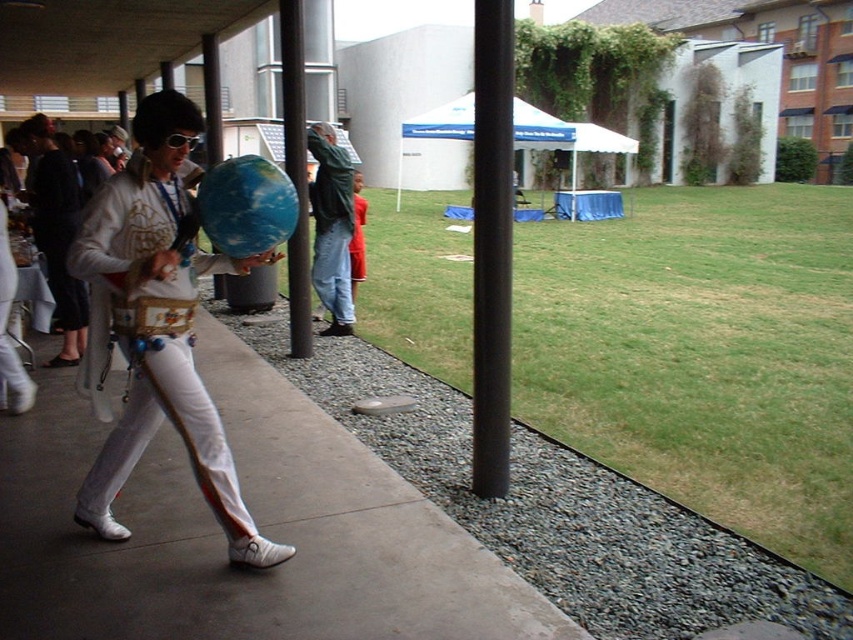
Consider the image. Can you confirm if concrete at center is positioned above jeans at center?

Actually, concrete at center is below jeans at center.

Is point (166, 561) in front of point (332, 240)?

Yes, it is.

Locate an element on the screen. This screenshot has width=853, height=640. concrete at center is located at coordinates (259, 525).

Where is `concrete at center`? This screenshot has width=853, height=640. concrete at center is located at coordinates (259, 525).

Who is more distant from viewer, (55, 152) or (294, 326)?

The point (294, 326) is behind.

Who is taller, white satin suit at center or black metal pole at center?

black metal pole at center

This screenshot has width=853, height=640. Identify the location of white satin suit at center. (56, 228).

Can you confirm if concrete at center is positioned below shiny gold belt at center?

Correct, concrete at center is located below shiny gold belt at center.

This screenshot has height=640, width=853. In order to click on concrete at center in this screenshot , I will do `click(259, 525)`.

Which is in front, point (22, 461) or point (143, 280)?

Point (143, 280) is more forward.

The height and width of the screenshot is (640, 853). In order to click on concrete at center in this screenshot , I will do `click(259, 525)`.